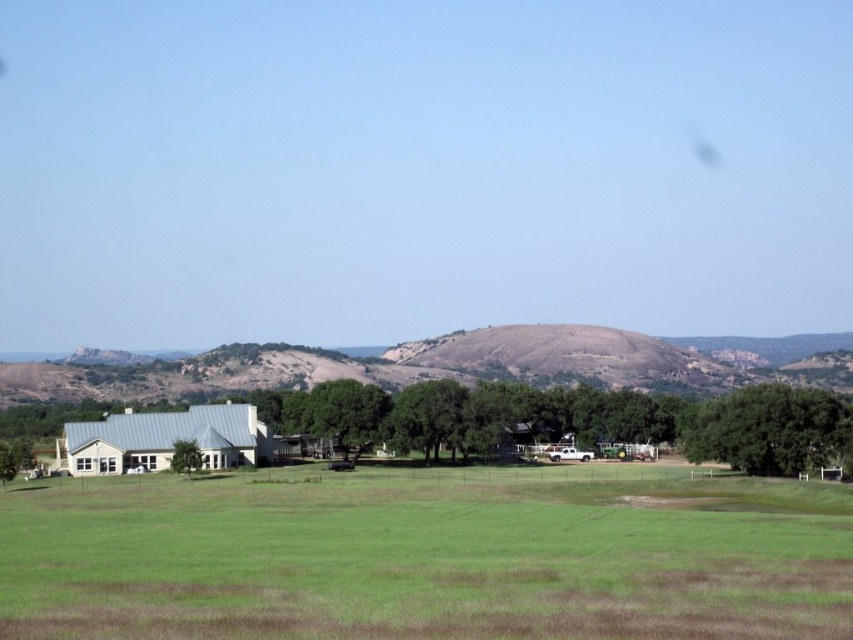
You are a hiker standing at the base of the brown rocky mountain at center and looking towards the green leafy tree at lower left. Can you see the entire tree from your current position?

The green leafy tree at lower left is behind the brown rocky mountain at center, so you cannot see the entire tree from your current position.

You are standing at the point with coordinates point [183,454] and want to walk to the point with coordinates point [178,541]. Which direction should you face to walk towards your destination?

Point [178,541] is in front of point [183,454], so you should face forward to walk towards your destination.

You are standing at the base of the brown rocky mountain at center and want to walk to the green leafy tree at lower left. According to the scene, which direction should you face to head towards the tree?

The brown rocky mountain at center is located above the green leafy tree at lower left, so you should face downward to head towards the green leafy tree at lower left.